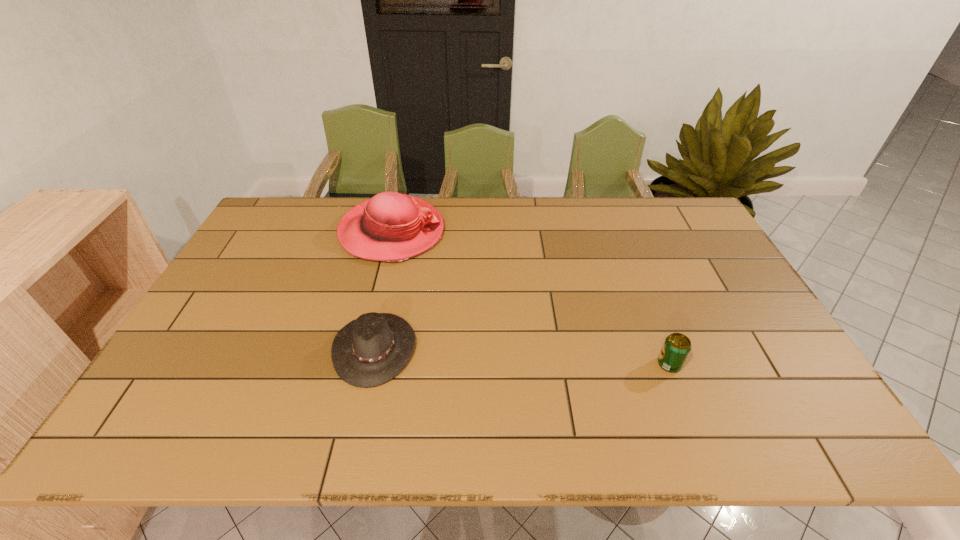
At what (x,y) coordinates should I click in order to perform the action: click on free space between the farthest object and the beer can. Please return your answer as a coordinate pair (x, y). This screenshot has width=960, height=540. Looking at the image, I should click on (531, 298).

The image size is (960, 540). In order to click on vacant area that lies between the taller hat and the beer can in this screenshot , I will do 531,298.

This screenshot has height=540, width=960. I want to click on object that is the closest to the rightmost object, so click(371, 350).

Locate which object ranks second in proximity to the rightmost object. Please provide its 2D coordinates. Your answer should be formatted as a tuple, i.e. [(x, y)], where the tuple contains the x and y coordinates of a point satisfying the conditions above.

[(391, 227)]

This screenshot has width=960, height=540. In order to click on free space that satisfies the following two spatial constraints: 1. at the front of the farther hat with a bow; 2. on the right side of the rightmost object in this screenshot , I will do `click(359, 364)`.

Find the location of a particular element. The height and width of the screenshot is (540, 960). vacant area in the image that satisfies the following two spatial constraints: 1. at the front of the farther hat with a bow; 2. on the right side of the rightmost object is located at coordinates (359, 364).

This screenshot has height=540, width=960. I want to click on vacant region that satisfies the following two spatial constraints: 1. at the front of the tallest object with a bow; 2. on the back side of the rightmost object, so click(359, 364).

You are a GUI agent. You are given a task and a screenshot of the screen. Output one action in this format:
    pyautogui.click(x=<x>, y=<y>)
    Task: Click on the free location that satisfies the following two spatial constraints: 1. on the back side of the beer can; 2. at the front of the farther hat with a bow
    
    Given the screenshot: What is the action you would take?
    pyautogui.click(x=617, y=232)

Identify the location of free space that satisfies the following two spatial constraints: 1. on the front-facing side of the beer can; 2. on the left side of the shorter hat. The height and width of the screenshot is (540, 960). (372, 364).

Where is `free space that satisfies the following two spatial constraints: 1. at the front of the rightmost object with a bow; 2. on the right side of the farther hat`? The image size is (960, 540). free space that satisfies the following two spatial constraints: 1. at the front of the rightmost object with a bow; 2. on the right side of the farther hat is located at coordinates (359, 364).